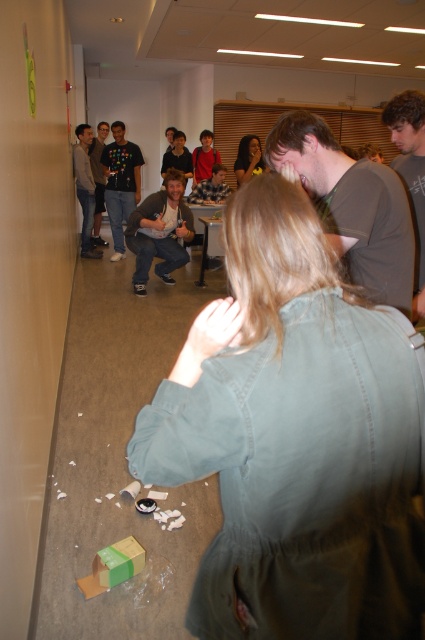
Who is positioned more to the left, checkered fabric shirt at center or dark gray hoodie at center?

dark gray hoodie at center

Which is behind, point (204, 195) or point (206, 170)?

Point (206, 170)

What are the coordinates of `checkered fabric shirt at center` in the screenshot? It's located at (210, 188).

Is checkered fabric shirt at center in front of matte black shirt at center?

That is True.

Locate an element on the screen. checkered fabric shirt at center is located at coordinates (210, 188).

Is dark gray t-shirt at center bigger than checkered fabric shirt at center?

Yes, dark gray t-shirt at center is bigger than checkered fabric shirt at center.

Measure the distance between dark gray t-shirt at center and camera.

dark gray t-shirt at center and camera are 6.90 meters apart from each other.

Describe the element at coordinates (98, 180) in the screenshot. I see `dark gray t-shirt at center` at that location.

In order to click on dark gray t-shirt at center in this screenshot , I will do `click(98, 180)`.